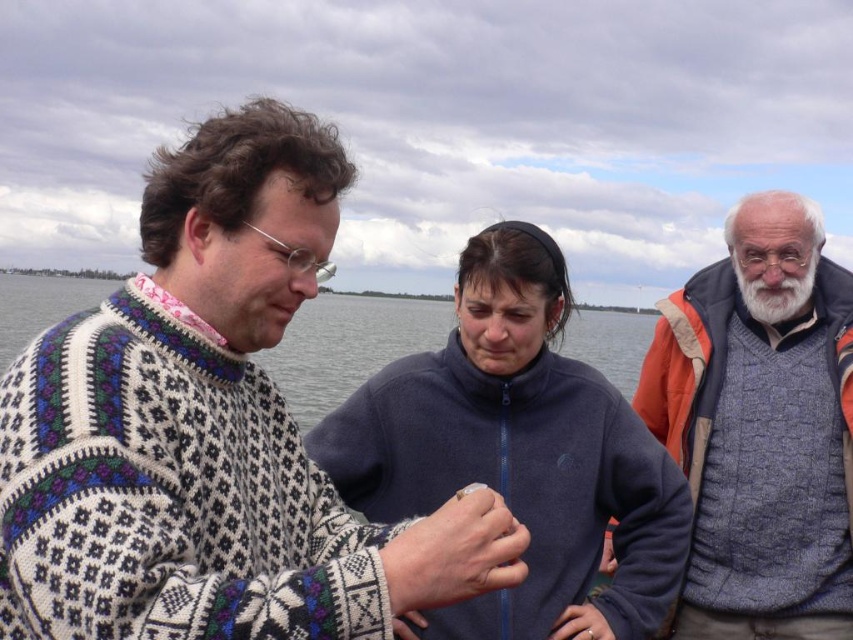
How much distance is there between knitted sweater at center and white fluffy beard at upper right?

8.41 meters

At what (x,y) coordinates should I click in order to perform the action: click on knitted sweater at center. Please return your answer as a coordinate pair (x, y). Looking at the image, I should click on (210, 429).

Which is in front, point (370, 499) or point (808, 268)?

Positioned in front is point (370, 499).

Describe the element at coordinates (518, 452) in the screenshot. I see `dark blue fleece at center` at that location.

I want to click on dark blue fleece at center, so click(x=518, y=452).

Does dark blue fleece at center appear on the left side of gray wool sweater at right?

Indeed, dark blue fleece at center is positioned on the left side of gray wool sweater at right.

Between point (412, 451) and point (846, 292), which one is positioned in front?

Positioned in front is point (412, 451).

The width and height of the screenshot is (853, 640). I want to click on dark blue fleece at center, so click(x=518, y=452).